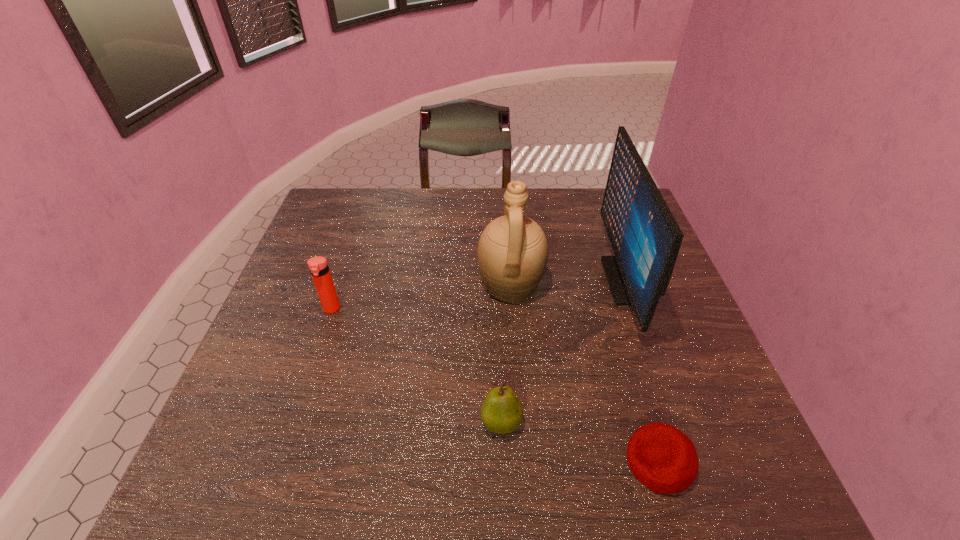
Where is `vacant area located on the right of the third tallest object`? vacant area located on the right of the third tallest object is located at coordinates (459, 309).

You are a GUI agent. You are given a task and a screenshot of the screen. Output one action in this format:
    pyautogui.click(x=<x>, y=<y>)
    Task: Click on the blank space located on the left of the fourth tallest object
    The width and height of the screenshot is (960, 540).
    Given the screenshot: What is the action you would take?
    (x=297, y=422)

Image resolution: width=960 pixels, height=540 pixels. Identify the location of vacant point located 0.050m on the seat area of the shortest object. (600, 462).

Locate an element on the screen. vacant space situated 0.200m on the seat area of the shortest object is located at coordinates (520, 462).

The width and height of the screenshot is (960, 540). In order to click on vacant area located on the seat area of the shortest object in this screenshot , I will do `click(573, 462)`.

At what (x,y) coordinates should I click in order to perform the action: click on object at the far edge. Please return your answer as a coordinate pair (x, y). The height and width of the screenshot is (540, 960). Looking at the image, I should click on (645, 237).

Locate an element on the screen. Image resolution: width=960 pixels, height=540 pixels. object that is at the near edge is located at coordinates pos(664,459).

I want to click on object situated at the left edge, so click(318, 266).

In order to click on computer monitor that is positioned at the right edge in this screenshot , I will do `click(645, 237)`.

Find the location of a particular element. beanbag positioned at the right edge is located at coordinates (664, 459).